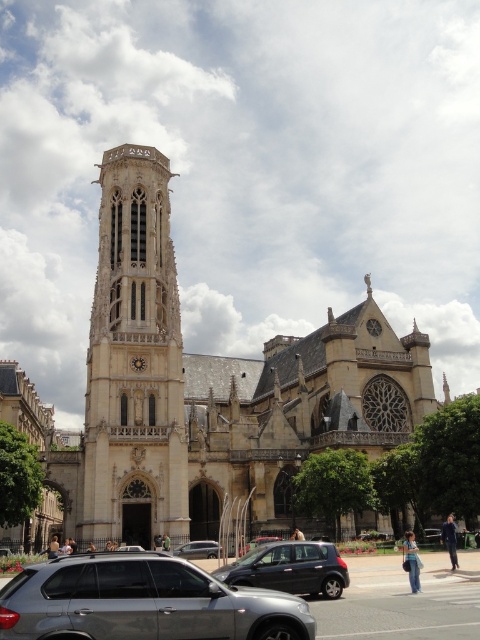
Looking at this image, you are a photographer planning to capture the golden stone church at center and the satin silver sedan at center in a single frame. Based on their sizes, which object should you position closer to the camera to ensure both fit within the frame?

Since the golden stone church at center is wider than the satin silver sedan at center, you should position the wider golden stone church at center closer to the camera to ensure both fit within the frame.

You are standing at the entrance of the grand Gothic church and want to park your silver metallic suv at lower center. The parking spot you want is at coordinate point 0.942, 0.296. Can you determine if your car is already parked in the desired spot?

The silver metallic suv at lower center is already parked at coordinate point (142, 602), so yes, it is in the desired spot.

You are a photographer trying to capture both the golden stone church at center and the satin silver sedan at center in a single frame. Based on their sizes, which object will appear bigger in your photo?

The golden stone church at center will appear bigger in the photo because it is larger in size than the satin silver sedan at center.